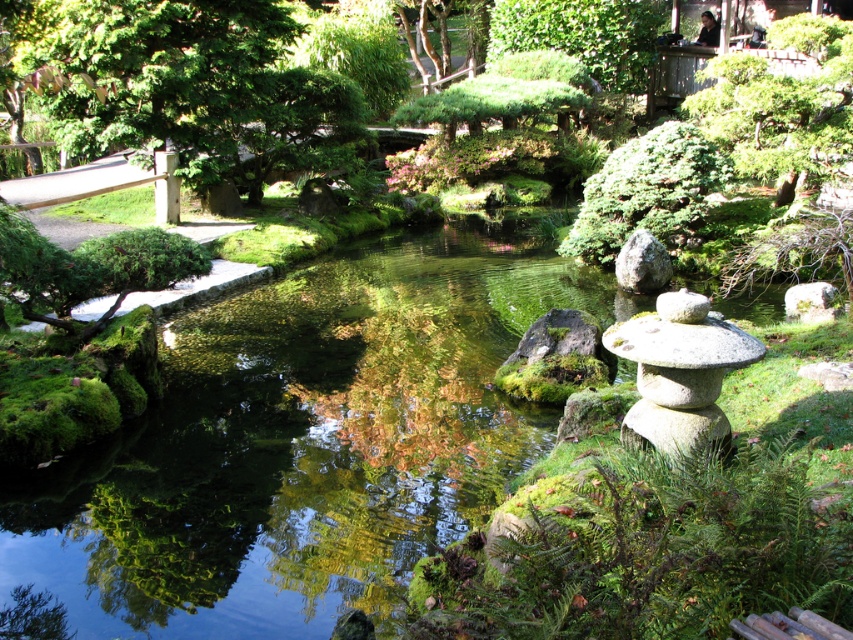
Between green leafy tree at upper left and gray rough rock at center, which one has less height?

gray rough rock at center

Can you confirm if green leafy tree at upper left is shorter than gray rough rock at center?

Incorrect, green leafy tree at upper left's height does not fall short of gray rough rock at center's.

Does point (103, 1) lie in front of point (633, 252)?

No, it is behind (633, 252).

Where is `green leafy tree at upper left`? green leafy tree at upper left is located at coordinates (190, 84).

Based on the photo, between green leafy tree at upper left and smooth gray stone at center-right, which one appears on the right side from the viewer's perspective?

smooth gray stone at center-right

The height and width of the screenshot is (640, 853). What are the coordinates of `green leafy tree at upper left` in the screenshot? It's located at (190, 84).

In order to click on green leafy tree at upper left in this screenshot , I will do `click(190, 84)`.

Is point (807, 115) positioned in front of point (821, 305)?

No.

At what (x,y) coordinates should I click in order to perform the action: click on green textured tree at upper right. Please return your answer as a coordinate pair (x, y). Image resolution: width=853 pixels, height=640 pixels. Looking at the image, I should click on (782, 106).

This screenshot has width=853, height=640. I want to click on green textured tree at upper right, so click(782, 106).